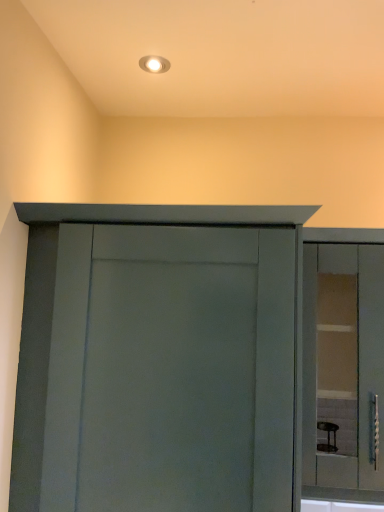
Question: Is clear glass cabinet at right in contact with matte gray cupboard at center?

Choices:
 (A) no
 (B) yes

Answer: (A)

Question: Can you confirm if clear glass cabinet at right is wider than matte gray cupboard at center?

Choices:
 (A) no
 (B) yes

Answer: (A)

Question: From the image's perspective, does clear glass cabinet at right appear higher than matte gray cupboard at center?

Choices:
 (A) yes
 (B) no

Answer: (A)

Question: From a real-world perspective, is clear glass cabinet at right positioned under matte gray cupboard at center based on gravity?

Choices:
 (A) no
 (B) yes

Answer: (A)

Question: Is clear glass cabinet at right positioned in front of matte gray cupboard at center?

Choices:
 (A) yes
 (B) no

Answer: (B)

Question: Does clear glass cabinet at right turn towards matte gray cupboard at center?

Choices:
 (A) no
 (B) yes

Answer: (A)

Question: Is matte gray cupboard at center positioned before clear glass cabinet at right?

Choices:
 (A) yes
 (B) no

Answer: (A)

Question: Does matte gray cupboard at center appear on the right side of clear glass cabinet at right?

Choices:
 (A) yes
 (B) no

Answer: (B)

Question: Is matte gray cupboard at center to the left of clear glass cabinet at right from the viewer's perspective?

Choices:
 (A) yes
 (B) no

Answer: (A)

Question: Does matte gray cupboard at center have a lesser width compared to clear glass cabinet at right?

Choices:
 (A) yes
 (B) no

Answer: (B)

Question: Are matte gray cupboard at center and clear glass cabinet at right beside each other?

Choices:
 (A) yes
 (B) no

Answer: (B)

Question: Can you confirm if matte gray cupboard at center is wider than clear glass cabinet at right?

Choices:
 (A) no
 (B) yes

Answer: (B)

Question: From the image's perspective, is matte gray cupboard at center above or below clear glass cabinet at right?

Choices:
 (A) below
 (B) above

Answer: (A)